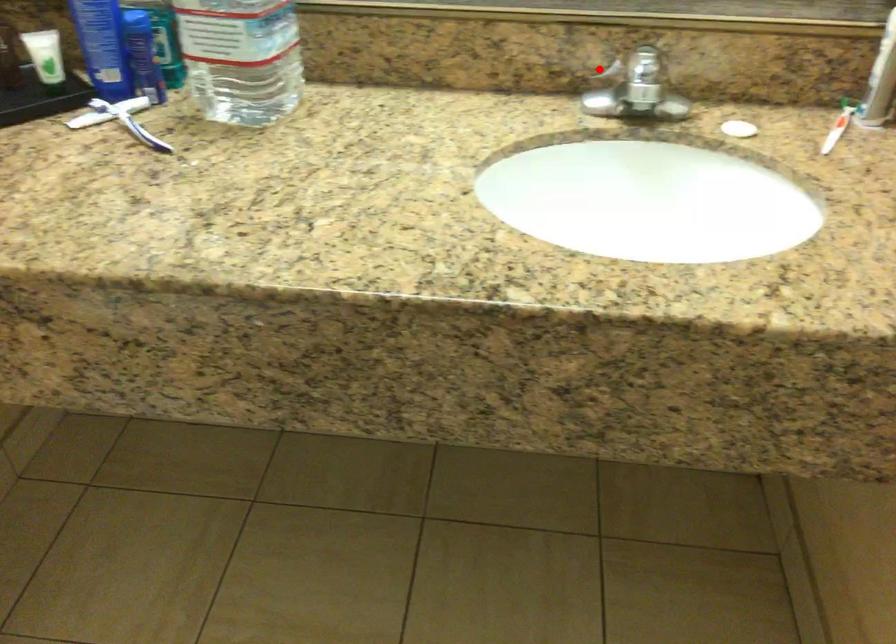
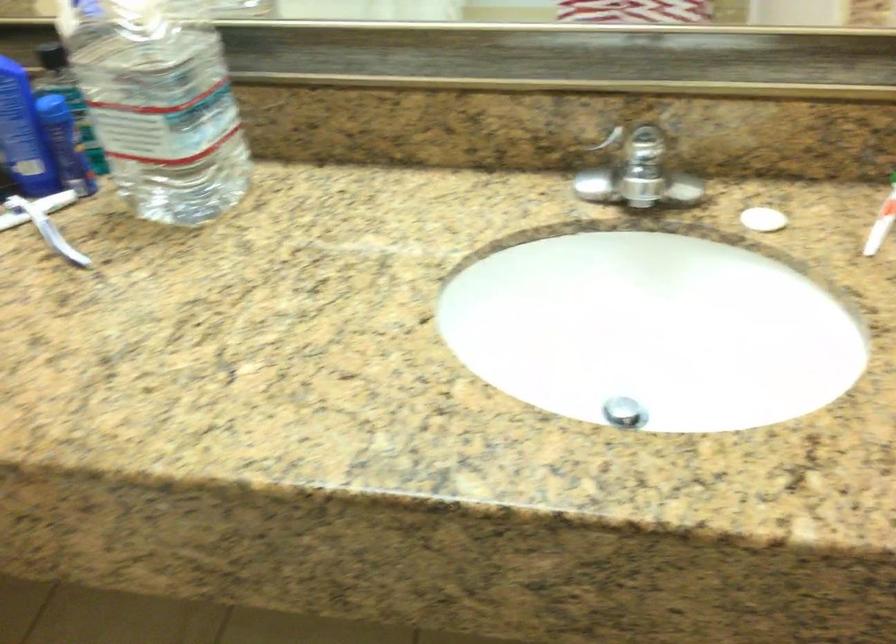
Question: I am providing you with two images of the same scene from different viewpoints. A red point is shown in image1. For the corresponding object point in image2, is it positioned nearer or farther from the camera?

Choices:
 (A) Nearer
 (B) Farther

Answer: (A)